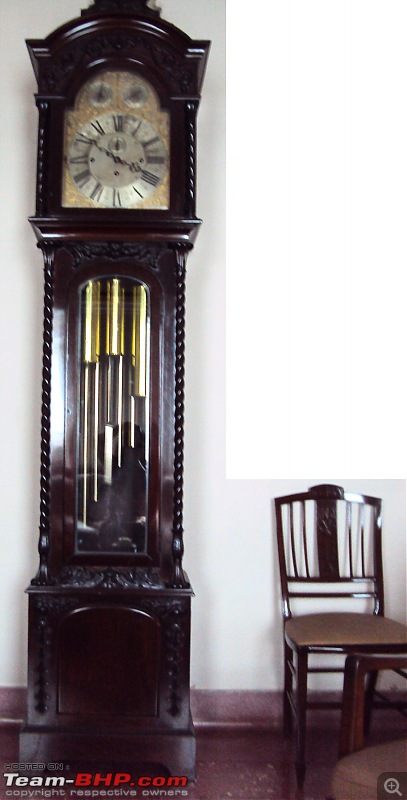
Locate an element on the screen. face of clock is located at coordinates (103, 165).